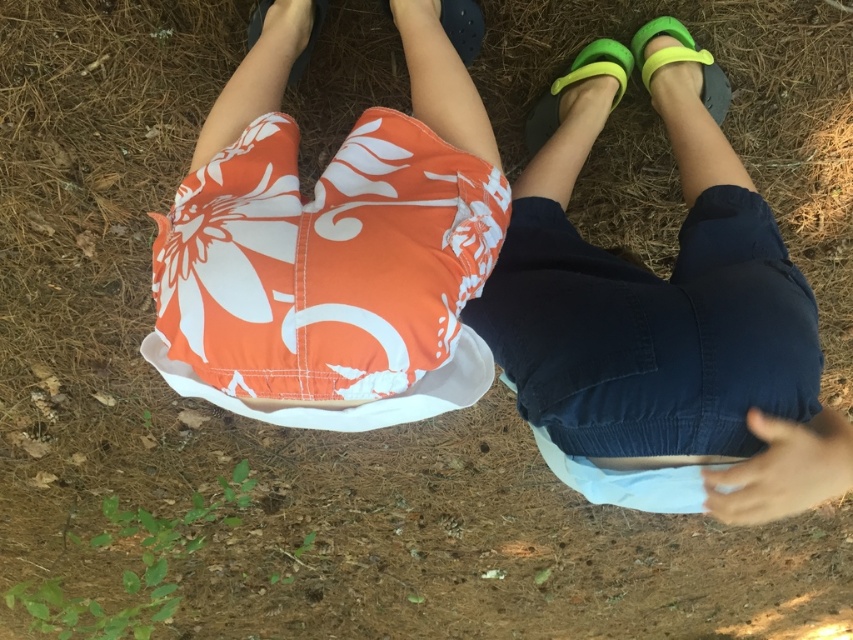
Looking at this image, you are a drone operator and need to locate the point at coordinates point (665,307). Based on the scene, where is this point located?

The point (665,307) is located on the dark blue denim shorts at center.

You are standing above the two people in the image and want to drop a small pebble. If you drop it exactly halfway between point [527,336] and point [262,49], will it land closer to the camera or further away from it?

The pebble will land closer to the camera because point [527,336] is closer to the camera than point [262,49], so the midpoint between them will be closer to the camera than the farther point.

You are designing a new clothing catalog and need to compare the widths of the dark blue denim shorts at center and the orange floral shorts at center. Which pair has a narrower width?

The dark blue denim shorts at center has a narrower width than the orange floral shorts at center.